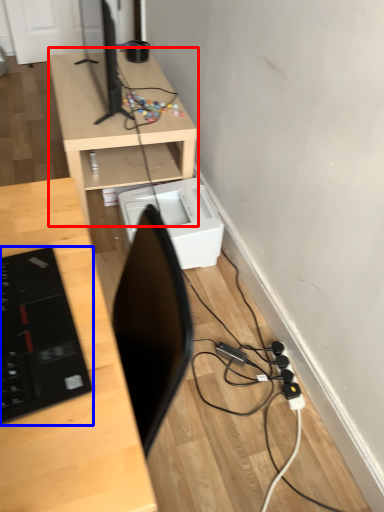
Question: Which object is closer to the camera taking this photo, desk (highlighted by a red box) or laptop (highlighted by a blue box)?

Choices:
 (A) desk
 (B) laptop

Answer: (B)